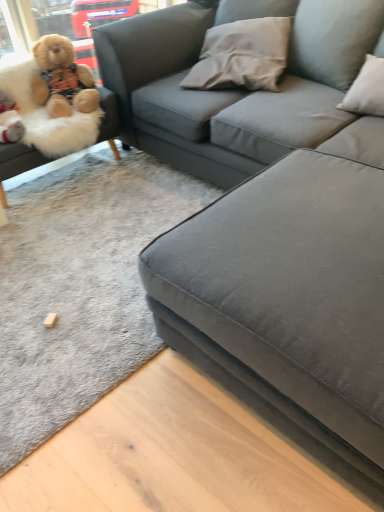
Question: Should I look upward or downward to see gray fabric pillow at upper center?

Choices:
 (A) down
 (B) up

Answer: (B)

Question: Is fluffy beige teddy bear at upper left located outside suede gray couch at center, placed as the first studio couch when sorted from right to left?

Choices:
 (A) yes
 (B) no

Answer: (B)

Question: Is fluffy beige teddy bear at upper left facing away from suede gray couch at center, which ranks as the 2th studio couch in left-to-right order?

Choices:
 (A) yes
 (B) no

Answer: (A)

Question: Is fluffy beige teddy bear at upper left oriented towards suede gray couch at center, which ranks as the 2th studio couch in left-to-right order?

Choices:
 (A) no
 (B) yes

Answer: (B)

Question: Does fluffy beige teddy bear at upper left come in front of suede gray couch at center, which ranks as the 2th studio couch in left-to-right order?

Choices:
 (A) no
 (B) yes

Answer: (A)

Question: From a real-world perspective, is fluffy beige teddy bear at upper left over suede gray couch at center, placed as the first studio couch when sorted from right to left?

Choices:
 (A) no
 (B) yes

Answer: (B)

Question: Is fluffy beige teddy bear at upper left shorter than suede gray couch at center, placed as the first studio couch when sorted from right to left?

Choices:
 (A) no
 (B) yes

Answer: (B)

Question: Is suede gray couch at center, placed as the first studio couch when sorted from right to left, to the right of fluffy beige teddy bear at upper left from the viewer's perspective?

Choices:
 (A) no
 (B) yes

Answer: (B)

Question: From a real-world perspective, is suede gray couch at center, which ranks as the 2th studio couch in left-to-right order, on fluffy beige teddy bear at upper left?

Choices:
 (A) yes
 (B) no

Answer: (B)

Question: From a real-world perspective, is suede gray couch at center, which ranks as the 2th studio couch in left-to-right order, beneath fluffy beige teddy bear at upper left?

Choices:
 (A) no
 (B) yes

Answer: (B)

Question: Is suede gray couch at center, placed as the first studio couch when sorted from right to left, further to camera compared to fluffy beige teddy bear at upper left?

Choices:
 (A) no
 (B) yes

Answer: (A)

Question: Is suede gray couch at center, which ranks as the 2th studio couch in left-to-right order, positioned before fluffy beige teddy bear at upper left?

Choices:
 (A) yes
 (B) no

Answer: (A)

Question: From the image's perspective, is suede gray couch at center, placed as the first studio couch when sorted from right to left, located beneath fluffy beige teddy bear at upper left?

Choices:
 (A) no
 (B) yes

Answer: (B)

Question: From the image's perspective, is fluffy beige teddy bear at upper left over fluffy beige teddy bear at left, which is counted as the first studio couch, starting from the left?

Choices:
 (A) yes
 (B) no

Answer: (A)